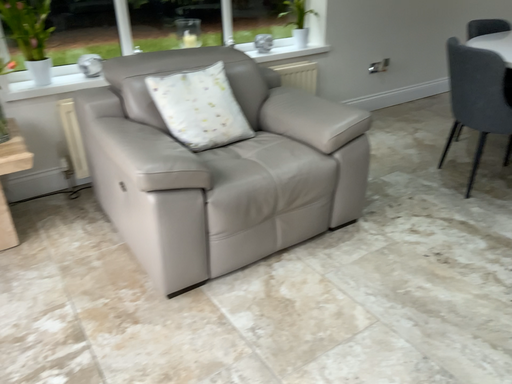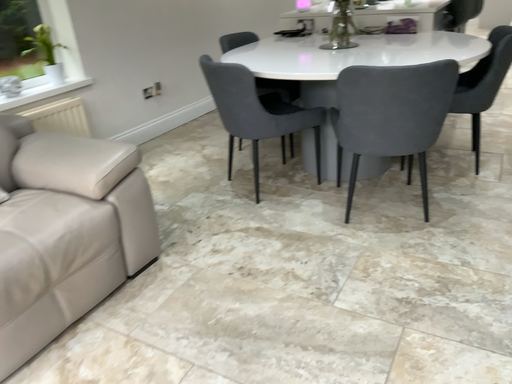
Question: How did the camera likely rotate when shooting the video?

Choices:
 (A) rotated left
 (B) rotated right

Answer: (B)